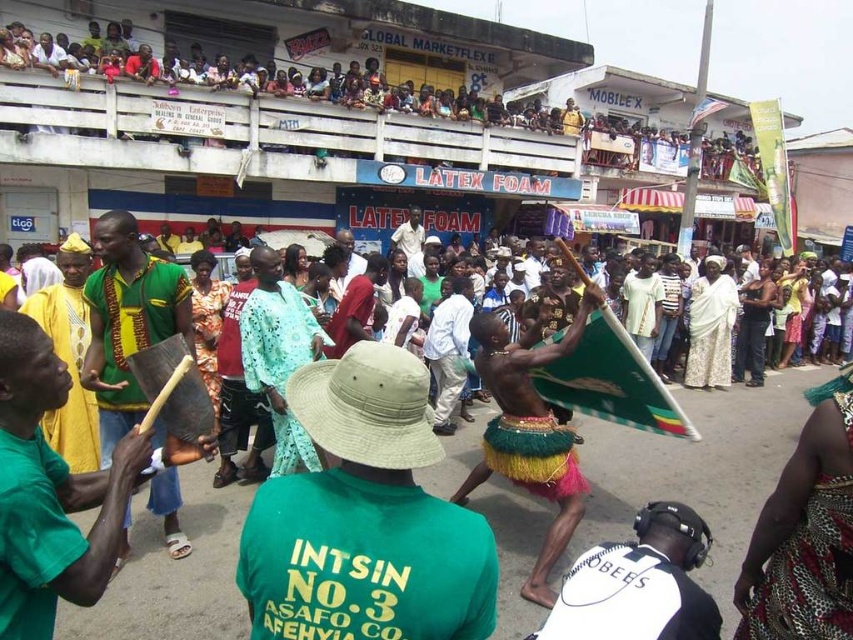
You are a photographer trying to capture both the green woven cloth at left and the white matte shirt at lower right in a single frame. Which object should you focus on first to ensure both are in the frame without moving your camera?

You should focus on the green woven cloth at left first since it is larger in size compared to the white matte shirt at lower right, allowing you to frame both effectively by centering the larger object.

You are a photographer trying to capture the vibrant atmosphere of this event. You notice a specific point at coordinates (343, 93). Where is this point located in relation to the multicolored fabric crowd at upper center?

The point at coordinates (343, 93) is located on the multicolored fabric crowd at upper center.